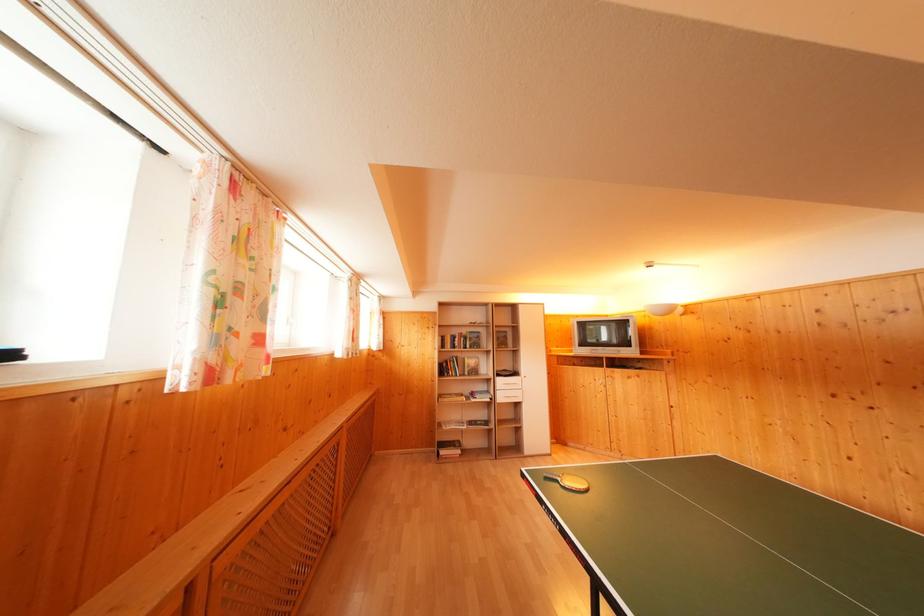
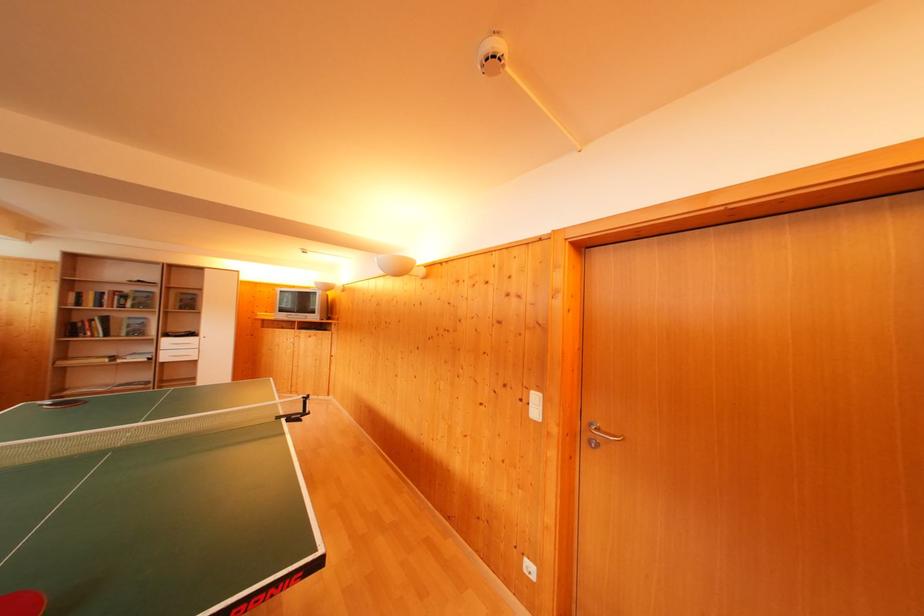
Find the pixel in the second image that matches (468,336) in the first image.

(131, 294)